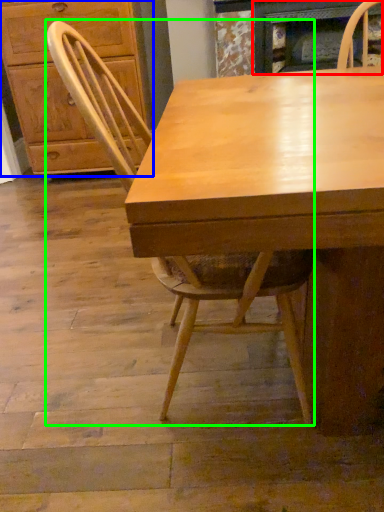
Question: Which object is the closest to the fireplace (highlighted by a red box)? Choose among these: cabinetry (highlighted by a blue box) or chair (highlighted by a green box).

Choices:
 (A) cabinetry
 (B) chair

Answer: (A)